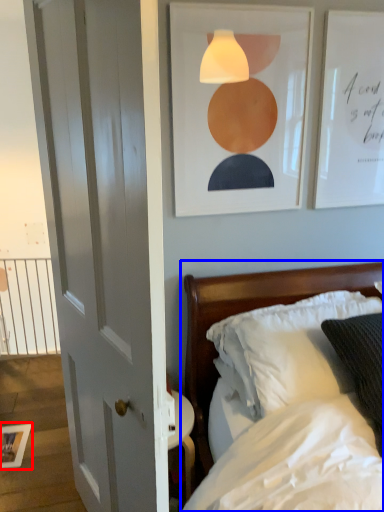
Question: Which of the following is the closest to the observer, picture frame (highlighted by a red box) or bed (highlighted by a blue box)?

Choices:
 (A) picture frame
 (B) bed

Answer: (B)